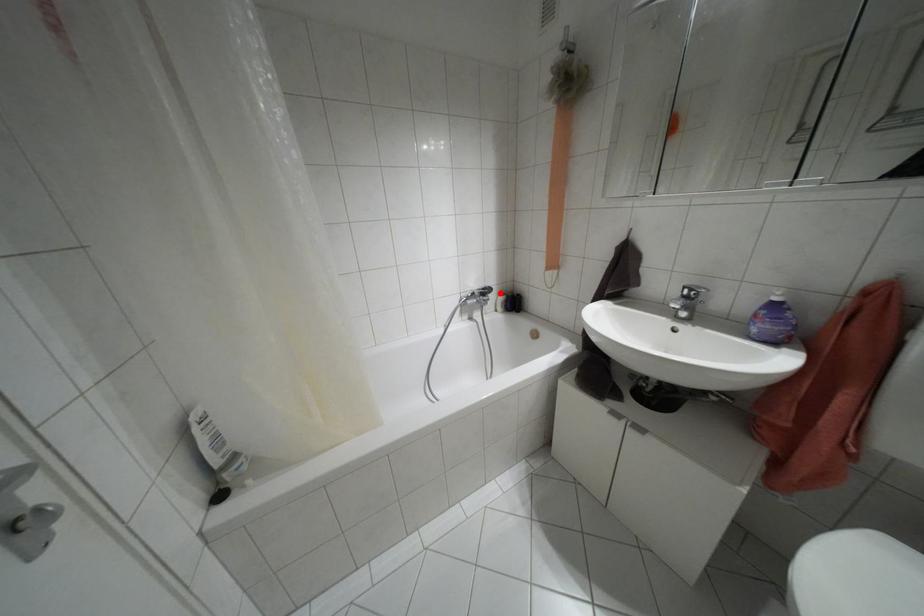
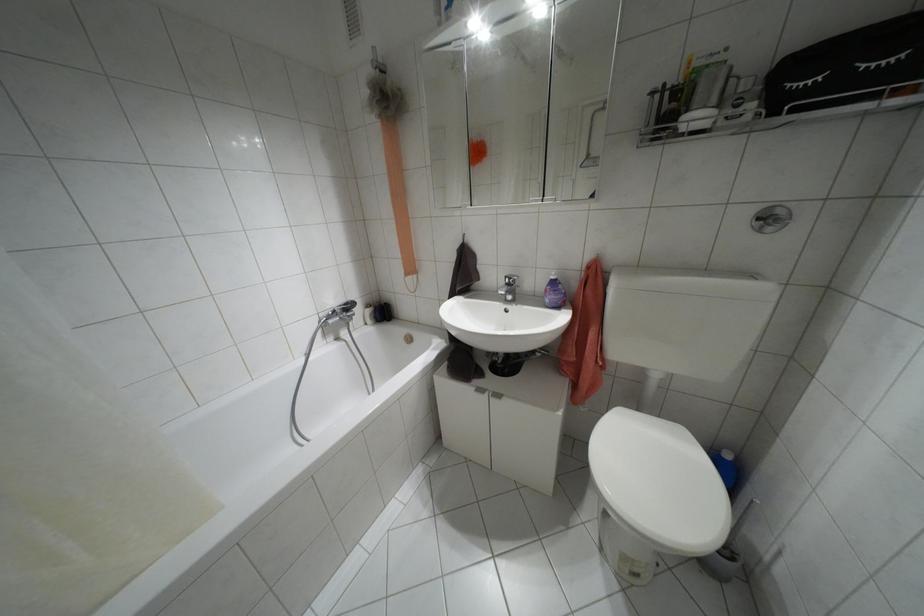
In the second image, find the point that corresponds to the highlighted location in the first image.

(367, 305)